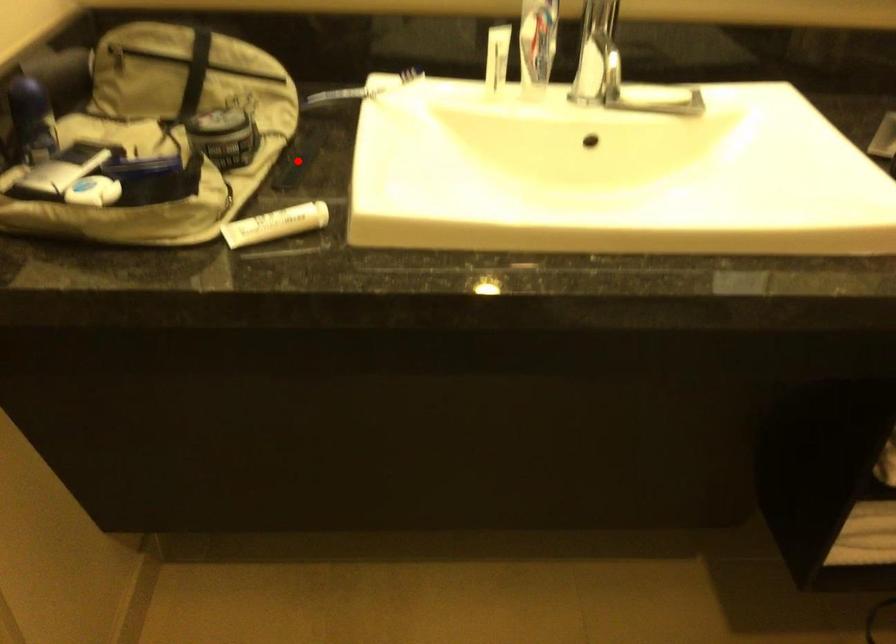
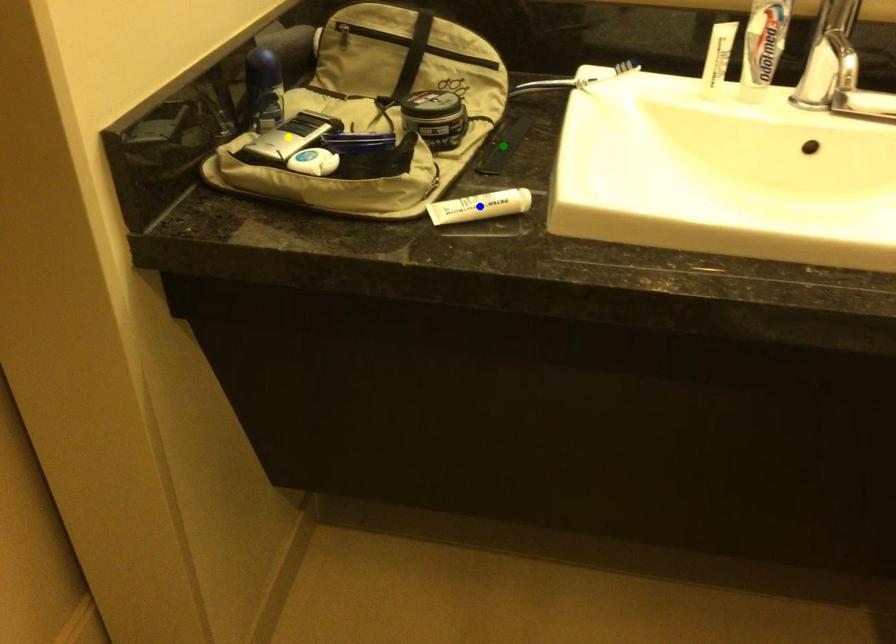
Question: I am providing you with two images of the same scene from different viewpoints. A red point is marked on the first image. You are given multiple points on the second image. In image 2, which mark is for the same physical point as the one in image 1?

Choices:
 (A) blue point
 (B) green point
 (C) yellow point

Answer: (B)